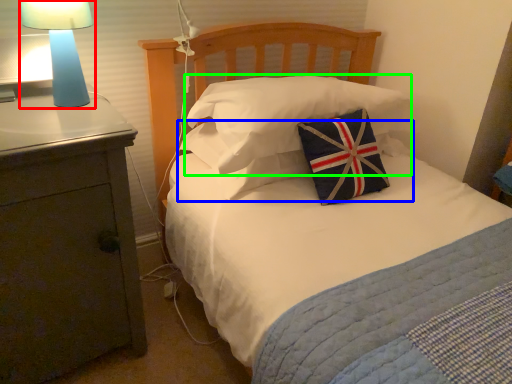
Question: Which is farther away from lamp (highlighted by a red box)? pillow (highlighted by a blue box) or pillow (highlighted by a green box)?

Choices:
 (A) pillow
 (B) pillow

Answer: (B)